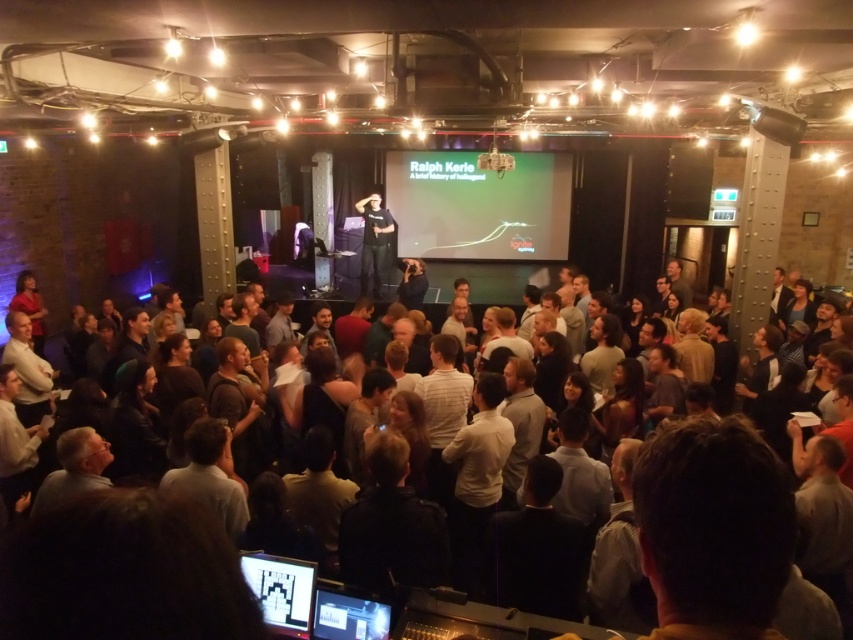
Who is positioned more to the left, light brown leather jacket at lower center or black matte shirt at center?

Positioned to the left is light brown leather jacket at lower center.

From the picture: Who is more distant from viewer, (238, 518) or (373, 218)?

Point (373, 218)

Locate an element on the screen. The image size is (853, 640). light brown leather jacket at lower center is located at coordinates tap(212, 474).

Between black leather jacket at center and matte black monitor at lower center, which one is positioned higher?

black leather jacket at center is above.

Is point (381, 595) closer to camera compared to point (283, 566)?

That is False.

Does point (347, 556) come in front of point (268, 570)?

No, it is behind (268, 570).

Image resolution: width=853 pixels, height=640 pixels. In order to click on black leather jacket at center in this screenshot , I will do `click(392, 525)`.

Is light brown leather jacket at lower center smaller than matte black monitor at lower center?

Incorrect, light brown leather jacket at lower center is not smaller in size than matte black monitor at lower center.

Does light brown leather jacket at lower center appear on the left side of matte black monitor at lower center?

Yes, light brown leather jacket at lower center is to the left of matte black monitor at lower center.

Find the location of a particular element. light brown leather jacket at lower center is located at coordinates (212, 474).

Identify the location of light brown leather jacket at lower center. (212, 474).